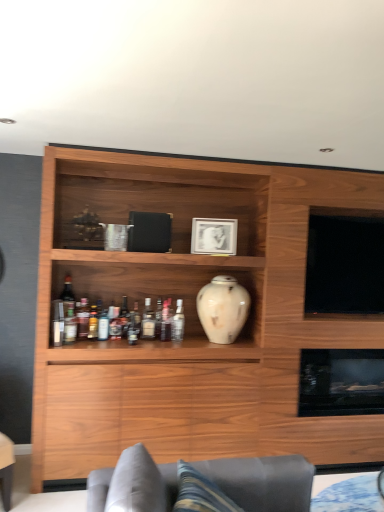
Describe the element at coordinates (214, 236) in the screenshot. I see `white glossy picture frame at upper center` at that location.

Where is `white glossy picture frame at upper center`? Image resolution: width=384 pixels, height=512 pixels. white glossy picture frame at upper center is located at coordinates (214, 236).

What is the approximate height of black glossy screen at upper right?

It is 31.30 inches.

In order to click on white glossy vase at center in this screenshot , I will do `click(223, 309)`.

The width and height of the screenshot is (384, 512). What do you see at coordinates (148, 321) in the screenshot?
I see `translucent glass bottle at middle, arranged as the 3th bottle when viewed from the right` at bounding box center [148, 321].

Describe the element at coordinates (193, 317) in the screenshot. The width and height of the screenshot is (384, 512). I see `wooden cabinet at center` at that location.

The width and height of the screenshot is (384, 512). Identify the location of white glossy picture frame at upper center. (214, 236).

From a real-world perspective, between translucent glass bottle at middle, the fourth bottle in the right-to-left sequence, and gray fabric couch at lower center, who is vertically higher?

translucent glass bottle at middle, the fourth bottle in the right-to-left sequence, from a real-world perspective.

From the picture: Which object is further away from the camera taking this photo, translucent glass bottle at middle, the third bottle when ordered from left to right, or gray fabric couch at lower center?

translucent glass bottle at middle, the third bottle when ordered from left to right, is further from the camera.

Who is shorter, translucent glass bottle at middle, the fourth bottle in the right-to-left sequence, or gray fabric couch at lower center?

Standing shorter between the two is translucent glass bottle at middle, the fourth bottle in the right-to-left sequence.

From the image's perspective, is translucent glass bottle at middle, the third bottle when ordered from left to right, above gray fabric couch at lower center?

Yes, from the image's perspective, translucent glass bottle at middle, the third bottle when ordered from left to right, is on top of gray fabric couch at lower center.

From a real-world perspective, which object stands above the other?

wooden cabinet at center, from a real-world perspective.

In the image, is wooden cabinet at center positioned in front of or behind translucent glass bottle at middle, the 2th bottle viewed from the right?

wooden cabinet at center is positioned closer to the viewer than translucent glass bottle at middle, the 2th bottle viewed from the right.

Is wooden cabinet at center surrounding translucent glass bottle at middle, the 2th bottle viewed from the right?

Yes, wooden cabinet at center is surrounding translucent glass bottle at middle, the 2th bottle viewed from the right.

Is wooden cabinet at center aimed at translucent glass bottle at middle, the fifth bottle from the left?

Yes, wooden cabinet at center is oriented towards translucent glass bottle at middle, the fifth bottle from the left.

From a real-world perspective, does translucent glass bottle at middle, the fifth bottle from the left, stand above gray fabric couch at lower center?

Yes, from a real-world perspective, translucent glass bottle at middle, the fifth bottle from the left, is over gray fabric couch at lower center

What's the angular difference between translucent glass bottle at middle, the 2th bottle viewed from the right, and gray fabric couch at lower center's facing directions?

The angle between the facing direction of translucent glass bottle at middle, the 2th bottle viewed from the right, and the facing direction of gray fabric couch at lower center is 89.8 degrees.

Which object is wider, translucent glass bottle at middle, the 2th bottle viewed from the right, or gray fabric couch at lower center?

gray fabric couch at lower center is wider.

Is point (166, 304) closer to viewer compared to point (171, 471)?

That is False.

Is translucent glass bottle at middle, arranged as the 3th bottle when viewed from the right, not inside black glass fireplace at lower right?

Yes, translucent glass bottle at middle, arranged as the 3th bottle when viewed from the right, is located beyond the bounds of black glass fireplace at lower right.

Looking at this image, is translucent glass bottle at middle, arranged as the 3th bottle when viewed from the right, to the left of black glass fireplace at lower right from the viewer's perspective?

Indeed, translucent glass bottle at middle, arranged as the 3th bottle when viewed from the right, is positioned on the left side of black glass fireplace at lower right.

How many degrees apart are the facing directions of gray fabric couch at lower center and translucent glass bottles at shelf center, the first bottle viewed from the left?

There is a 92.9-degree angle between the facing directions of gray fabric couch at lower center and translucent glass bottles at shelf center, the first bottle viewed from the left.

Is point (234, 467) closer or farther from the camera than point (86, 314)?

Point (234, 467) is positioned closer to the camera compared to point (86, 314).

In the scene shown: From the image's perspective, is gray fabric couch at lower center positioned above or below translucent glass bottles at shelf center, the sixth bottle from the right?

gray fabric couch at lower center is below translucent glass bottles at shelf center, the sixth bottle from the right.

From a real-world perspective, is white glossy vase at center below translucent glass bottle at center, which appears as the 5th bottle when viewed from the right?

No.

Where is `vase that is above the translucent glass bottle at center, which ranks as the second bottle in left-to-right order (from the image's perspective)`? This screenshot has width=384, height=512. vase that is above the translucent glass bottle at center, which ranks as the second bottle in left-to-right order (from the image's perspective) is located at coordinates (223, 309).

Does point (230, 331) appear closer or farther from the camera than point (119, 330)?

Point (230, 331).

From the image's perspective, does white glossy vase at center appear higher than translucent glass bottle at center, which ranks as the second bottle in left-to-right order?

Yes, from the image's perspective, white glossy vase at center is above translucent glass bottle at center, which ranks as the second bottle in left-to-right order.

Is white glossy picture frame at upper center at the right side of black glass fireplace at lower right?

Incorrect, white glossy picture frame at upper center is not on the right side of black glass fireplace at lower right.

Is white glossy picture frame at upper center in front of or behind black glass fireplace at lower right in the image?

In the image, white glossy picture frame at upper center appears in front of black glass fireplace at lower right.

Does point (211, 226) come in front of point (371, 375)?

Yes.

Is white glossy picture frame at upper center thinner than black glass fireplace at lower right?

Yes.

Find the location of `bottle that is the 2nd object located behind the gray fabric couch at lower center`. bottle that is the 2nd object located behind the gray fabric couch at lower center is located at coordinates (134, 325).

The height and width of the screenshot is (512, 384). I want to click on the 2nd bottle located beneath the wooden cabinet at center (from a real-world perspective), so click(166, 321).

Looking at this image, looking at the image, which one is located closer to clear glass bottle at center, which appears as the sixth bottle when viewed from the left, black glossy screen at upper right or translucent glass bottle at center, which ranks as the second bottle in left-to-right order?

The object closer to clear glass bottle at center, which appears as the sixth bottle when viewed from the left, is translucent glass bottle at center, which ranks as the second bottle in left-to-right order.

From the image, which object appears to be farther from white glossy picture frame at upper center, clear glass bottle at center, which appears as the sixth bottle when viewed from the left, or translucent glass bottles at shelf center, the sixth bottle from the right?

translucent glass bottles at shelf center, the sixth bottle from the right, is further to white glossy picture frame at upper center.

From the image, which object appears to be farther from translucent glass bottle at center, which ranks as the second bottle in left-to-right order, clear glass bottle at center, which ranks as the 1th bottle in right-to-left order, or translucent glass bottle at middle, the fifth bottle from the left?

The object further to translucent glass bottle at center, which ranks as the second bottle in left-to-right order, is clear glass bottle at center, which ranks as the 1th bottle in right-to-left order.

Looking at the image, which one is located closer to wooden cabinet at center, translucent glass bottle at middle, arranged as the 3th bottle when viewed from the right, or translucent glass bottle at center, which appears as the 5th bottle when viewed from the right?

The object closer to wooden cabinet at center is translucent glass bottle at middle, arranged as the 3th bottle when viewed from the right.

Looking at the image, which one is located further to translucent glass bottle at middle, the fourth bottle in the right-to-left sequence, wooden cabinet at center or translucent glass bottle at center, which ranks as the second bottle in left-to-right order?

wooden cabinet at center is positioned further to the anchor translucent glass bottle at middle, the fourth bottle in the right-to-left sequence.

Estimate the real-world distances between objects in this image. Which object is closer to white glossy vase at center, translucent glass bottle at middle, the 2th bottle viewed from the right, or translucent glass bottle at center, which ranks as the second bottle in left-to-right order?

translucent glass bottle at middle, the 2th bottle viewed from the right, is positioned closer to the anchor white glossy vase at center.

From the image, which object appears to be farther from gray fabric couch at lower center, translucent glass bottle at middle, the 2th bottle viewed from the right, or translucent glass bottle at center, which appears as the 5th bottle when viewed from the right?

Among the two, translucent glass bottle at center, which appears as the 5th bottle when viewed from the right, is located further to gray fabric couch at lower center.

Which object lies further to the anchor point translucent glass bottle at middle, arranged as the 3th bottle when viewed from the right, translucent glass bottles at shelf center, the first bottle viewed from the left, or translucent glass bottle at middle, the fifth bottle from the left?

translucent glass bottles at shelf center, the first bottle viewed from the left, lies further to translucent glass bottle at middle, arranged as the 3th bottle when viewed from the right, than the other object.

Image resolution: width=384 pixels, height=512 pixels. I want to click on cabinetry located between white glossy picture frame at upper center and black glass fireplace at lower right in the left-right direction, so click(193, 317).

At what (x,y) coordinates should I click in order to perform the action: click on cabinetry situated between white glossy picture frame at upper center and black glossy screen at upper right from left to right. Please return your answer as a coordinate pair (x, y). Looking at the image, I should click on (193, 317).

I want to click on picture frame situated between translucent glass bottles at shelf center, the sixth bottle from the right, and black glass fireplace at lower right from left to right, so click(x=214, y=236).

Find the location of a particular element. The height and width of the screenshot is (512, 384). vase between translucent glass bottles at shelf center, the sixth bottle from the right, and black glossy screen at upper right is located at coordinates (223, 309).